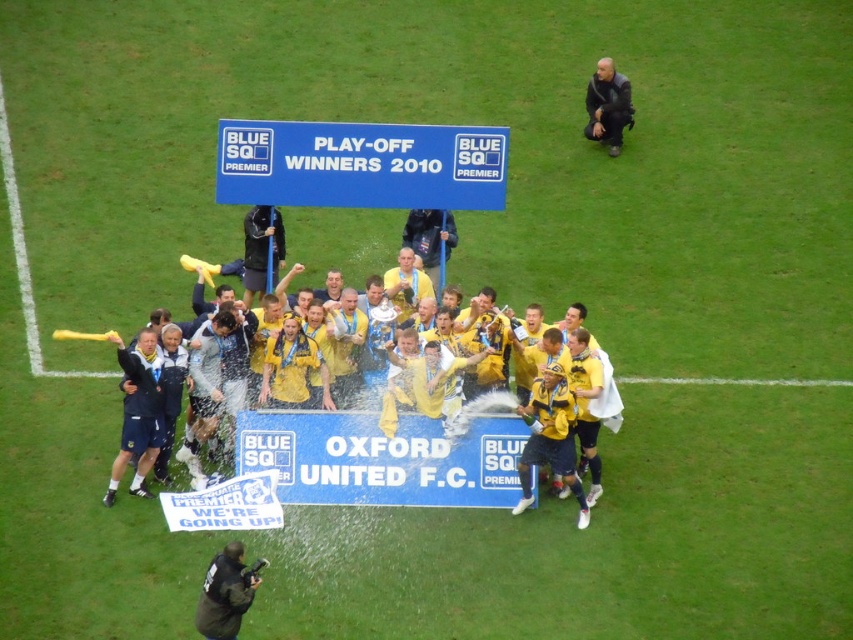
Who is taller, yellow jersey at center or dark green jacket at lower center?

With more height is yellow jersey at center.

Can you confirm if yellow jersey at center is taller than dark green jacket at lower center?

Yes, yellow jersey at center is taller than dark green jacket at lower center.

Between point (386, 429) and point (230, 637), which one is positioned in front?

Point (230, 637)

Locate an element on the screen. yellow jersey at center is located at coordinates (396, 406).

Can you confirm if yellow jersey at center is positioned to the right of black fabric referee at upper right?

Incorrect, yellow jersey at center is not on the right side of black fabric referee at upper right.

Is yellow jersey at center behind black fabric referee at upper right?

No, it is not.

Is point (358, 337) farther from viewer compared to point (601, 134)?

No, (358, 337) is closer to viewer.

You are a GUI agent. You are given a task and a screenshot of the screen. Output one action in this format:
    pyautogui.click(x=<x>, y=<y>)
    Task: Click on the yellow jersey at center
    
    Given the screenshot: What is the action you would take?
    pyautogui.click(x=396, y=406)

Is point (224, 560) farther from viewer compared to point (610, 109)?

That is False.

Can you confirm if dark green jacket at lower center is positioned below black fabric referee at upper right?

Yes, dark green jacket at lower center is below black fabric referee at upper right.

What are the coordinates of `dark green jacket at lower center` in the screenshot? It's located at (224, 593).